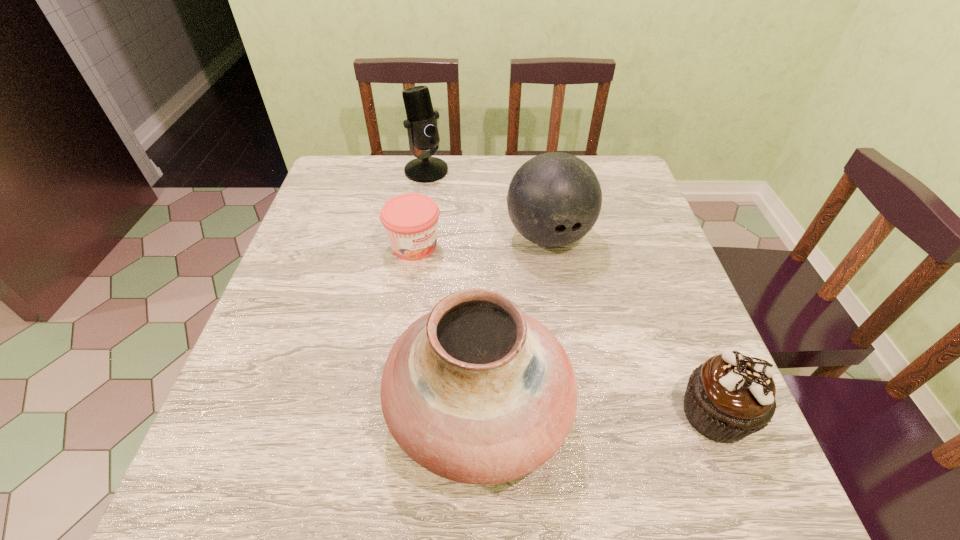
I want to click on vacant space in between the microphone and the bowling ball, so click(488, 203).

This screenshot has height=540, width=960. What are the coordinates of `free spot between the pottery and the cupcake` in the screenshot? It's located at coord(597,412).

Locate an element on the screen. This screenshot has width=960, height=540. free space between the pottery and the cupcake is located at coordinates (597, 412).

This screenshot has width=960, height=540. I want to click on vacant area that lies between the jam and the bowling ball, so click(x=481, y=241).

The height and width of the screenshot is (540, 960). I want to click on vacant area that lies between the microphone and the rightmost object, so click(x=571, y=292).

This screenshot has height=540, width=960. I want to click on free spot between the bowling ball and the cupcake, so click(632, 325).

Locate which object ranks third in proximity to the microphone. Please provide its 2D coordinates. Your answer should be formatted as a tuple, i.e. [(x, y)], where the tuple contains the x and y coordinates of a point satisfying the conditions above.

[(476, 391)]

Locate an element on the screen. This screenshot has height=540, width=960. object that stands as the second closest to the jam is located at coordinates (421, 124).

The width and height of the screenshot is (960, 540). I want to click on free location that satisfies the following two spatial constraints: 1. on the front side of the farthest object; 2. on the left side of the pottery, so click(390, 410).

The width and height of the screenshot is (960, 540). I want to click on free spot that satisfies the following two spatial constraints: 1. on the front side of the bowling ball; 2. on the left side of the rightmost object, so click(x=578, y=414).